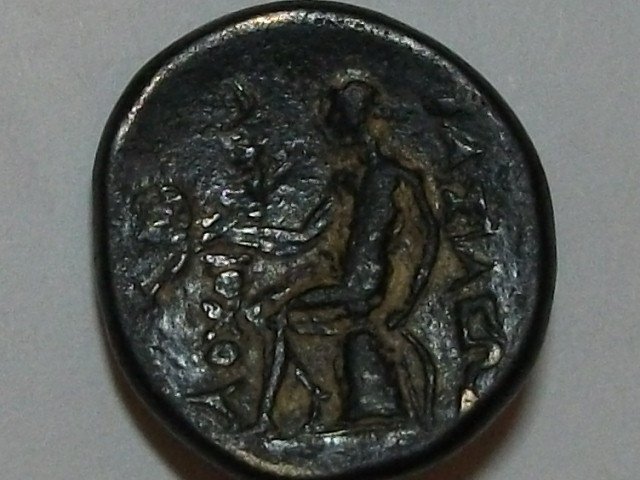
Locate an element on the screen. The height and width of the screenshot is (480, 640). table the coin is on is located at coordinates (576, 112).